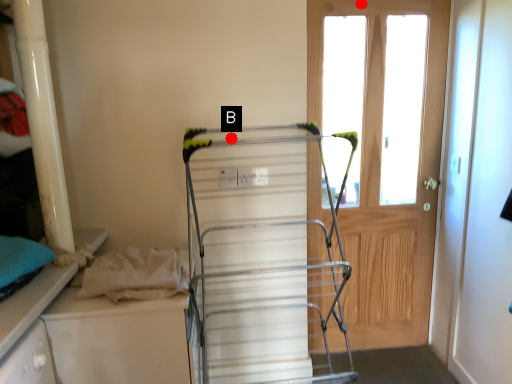
Question: Two points are circled on the image, labeled by A and B beside each circle. Among these points, which one is farthest from the camera?

Choices:
 (A) A is further
 (B) B is further

Answer: (A)